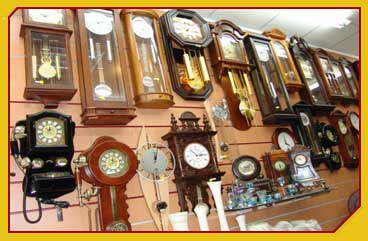
Locate an element on the screen. The image size is (368, 241). black clock arm is located at coordinates (156, 152), (285, 141).